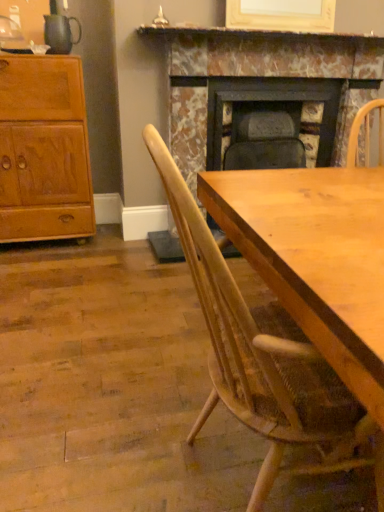
Question: Could light wood chair at center be considered to be inside light brown wood cabinet at left?

Choices:
 (A) no
 (B) yes

Answer: (A)

Question: Is light brown wood cabinet at left oriented towards light wood chair at center?

Choices:
 (A) no
 (B) yes

Answer: (B)

Question: Does light brown wood cabinet at left have a greater height compared to light wood chair at center?

Choices:
 (A) no
 (B) yes

Answer: (B)

Question: From the image's perspective, does light brown wood cabinet at left appear lower than light wood chair at center?

Choices:
 (A) yes
 (B) no

Answer: (B)

Question: Is light brown wood cabinet at left wider than light wood chair at center?

Choices:
 (A) yes
 (B) no

Answer: (B)

Question: Is light brown wood cabinet at left closer to the viewer compared to light wood chair at center?

Choices:
 (A) yes
 (B) no

Answer: (B)

Question: Could you tell me if light brown wood cabinet at left is facing marble fireplace at upper center?

Choices:
 (A) yes
 (B) no

Answer: (B)

Question: Can you confirm if light brown wood cabinet at left is thinner than marble fireplace at upper center?

Choices:
 (A) no
 (B) yes

Answer: (A)

Question: Can you confirm if light brown wood cabinet at left is taller than marble fireplace at upper center?

Choices:
 (A) yes
 (B) no

Answer: (A)

Question: Can you confirm if light brown wood cabinet at left is shorter than marble fireplace at upper center?

Choices:
 (A) yes
 (B) no

Answer: (B)

Question: Can you confirm if light brown wood cabinet at left is positioned to the left of marble fireplace at upper center?

Choices:
 (A) no
 (B) yes

Answer: (B)

Question: From the image's perspective, is light brown wood cabinet at left on top of marble fireplace at upper center?

Choices:
 (A) yes
 (B) no

Answer: (B)

Question: Can you confirm if light wood chair at center is positioned to the left of marble fireplace at upper center?

Choices:
 (A) yes
 (B) no

Answer: (A)